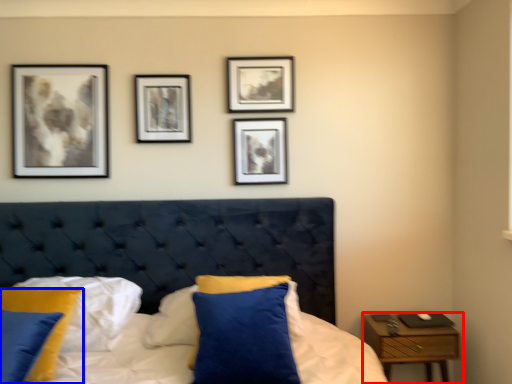
Question: Among these objects, which one is nearest to the camera, nightstand (highlighted by a red box) or pillow (highlighted by a blue box)?

Choices:
 (A) nightstand
 (B) pillow

Answer: (B)